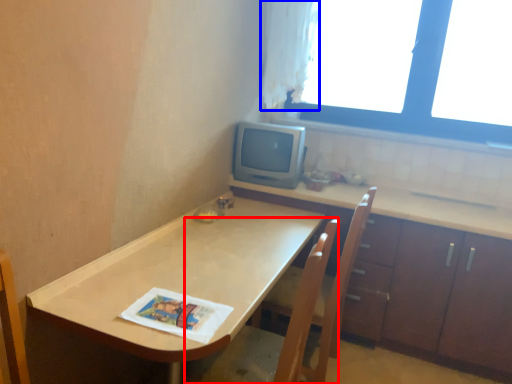
Question: Which point is further to the camera, swivel chair (highlighted by a red box) or curtain (highlighted by a blue box)?

Choices:
 (A) swivel chair
 (B) curtain

Answer: (B)